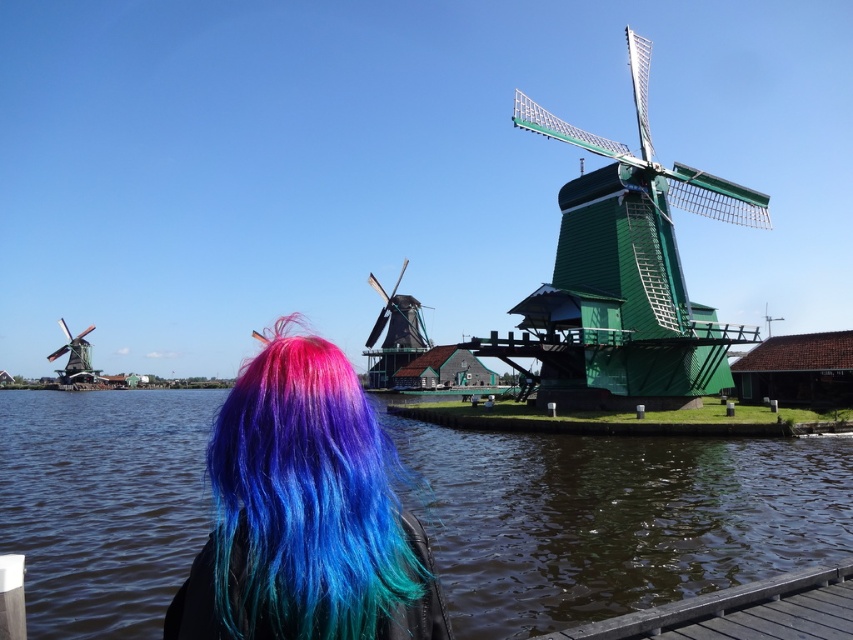
Does multicolored hair at center lie behind brown wooden dock at lower right?

No, it is in front of brown wooden dock at lower right.

Is point (308, 410) closer to viewer compared to point (734, 621)?

Yes, it is in front of point (734, 621).

Locate an element on the screen. This screenshot has width=853, height=640. multicolored hair at center is located at coordinates (305, 513).

Between transparent water at lower center and multicolored hair at center, which one is positioned higher?

multicolored hair at center is higher up.

Who is positioned more to the left, transparent water at lower center or multicolored hair at center?

transparent water at lower center is more to the left.

Measure the distance between transparent water at lower center and camera.

transparent water at lower center is 30.54 meters from camera.

Image resolution: width=853 pixels, height=640 pixels. Identify the location of transparent water at lower center. (614, 518).

Which is below, transparent water at lower center or brown wooden dock at lower right?

transparent water at lower center

Which is behind, point (62, 420) or point (735, 602)?

The point (62, 420) is behind.

The height and width of the screenshot is (640, 853). I want to click on transparent water at lower center, so (614, 518).

Locate an element on the screen. The height and width of the screenshot is (640, 853). transparent water at lower center is located at coordinates (614, 518).